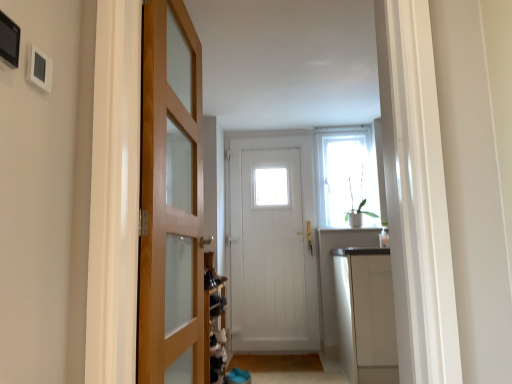
Locate an element on the screen. This screenshot has width=512, height=384. brown carpet at lower center, acting as the 2th path starting from the back is located at coordinates (288, 369).

Where is `brown wooden mat at lower center, positioned as the first path in back-to-front order`? brown wooden mat at lower center, positioned as the first path in back-to-front order is located at coordinates (276, 362).

What is the approximate height of wooden door at left, which appears as the first door when viewed from the left?

wooden door at left, which appears as the first door when viewed from the left, is 5.41 feet tall.

At what (x,y) coordinates should I click in order to perform the action: click on brown carpet at lower center, acting as the 2th path starting from the back. Please return your answer as a coordinate pair (x, y). Looking at the image, I should click on (288, 369).

Is wooden door at left, which appears as the first door when viewed from the left, looking in the opposite direction of white wooden door at center, arranged as the 2th door when viewed from the front?

No, wooden door at left, which appears as the first door when viewed from the left, is not facing away from white wooden door at center, arranged as the 2th door when viewed from the front.

From a real-world perspective, is wooden door at left, which appears as the first door when viewed from the left, below white wooden door at center, which appears as the first door when viewed from the back?

No.

At what (x,y) coordinates should I click in order to perform the action: click on door located below the wooden door at left, the 2th door when ordered from right to left (from the image's perspective). Please return your answer as a coordinate pair (x, y). The height and width of the screenshot is (384, 512). Looking at the image, I should click on (273, 246).

Is wooden door at left, the first door when ordered from front to back, directly adjacent to white wooden door at center, the second door from the left?

No, wooden door at left, the first door when ordered from front to back, is not beside white wooden door at center, the second door from the left.

Looking at this image, does green matte plant at upper right turn towards brown carpet at lower center, which is the 1th path from front to back?

No, green matte plant at upper right is not aimed at brown carpet at lower center, which is the 1th path from front to back.

Does green matte plant at upper right appear on the right side of brown carpet at lower center, which is the 1th path from front to back?

Yes.

Who is bigger, green matte plant at upper right or brown carpet at lower center, which is the 1th path from front to back?

green matte plant at upper right is bigger.

Looking at this image, what's the angular difference between green matte plant at upper right and brown carpet at lower center, which is the 1th path from front to back,'s facing directions?

The angle between the facing direction of green matte plant at upper right and the facing direction of brown carpet at lower center, which is the 1th path from front to back, is 1.01 degrees.

Does white glossy cabinet at right have a greater width compared to brown carpet at lower center, acting as the 2th path starting from the back?

In fact, white glossy cabinet at right might be narrower than brown carpet at lower center, acting as the 2th path starting from the back.

Could you tell me if white glossy cabinet at right is turned towards brown carpet at lower center, acting as the 2th path starting from the back?

No.

From the image's perspective, would you say white glossy cabinet at right is shown under brown carpet at lower center, acting as the 2th path starting from the back?

No, from the image's perspective, white glossy cabinet at right is not below brown carpet at lower center, acting as the 2th path starting from the back.

From a real-world perspective, is white glossy cabinet at right beneath brown carpet at lower center, acting as the 2th path starting from the back?

No, from a real-world perspective, white glossy cabinet at right is not beneath brown carpet at lower center, acting as the 2th path starting from the back.

Considering the relative positions of white glossy cabinet at right and green matte plant at upper right in the image provided, is white glossy cabinet at right behind green matte plant at upper right?

No, white glossy cabinet at right is in front of green matte plant at upper right.

Based on the photo, is green matte plant at upper right a part of white glossy cabinet at right?

No, green matte plant at upper right is not surrounded by white glossy cabinet at right.

Considering the sizes of objects white glossy cabinet at right and green matte plant at upper right in the image provided, who is smaller, white glossy cabinet at right or green matte plant at upper right?

Smaller between the two is green matte plant at upper right.

Looking at their sizes, would you say white glossy cabinet at right is wider or thinner than green matte plant at upper right?

white glossy cabinet at right is wider than green matte plant at upper right.

Which is farther, (361, 177) or (166, 288)?

Positioned behind is point (361, 177).

From a real-world perspective, who is located higher, green matte plant at upper right or wooden door at left, the first door when ordered from front to back?

From a 3D spatial view, green matte plant at upper right is above.

From the picture: Is green matte plant at upper right bigger or smaller than wooden door at left, which appears as the first door when viewed from the left?

Clearly, green matte plant at upper right is smaller in size than wooden door at left, which appears as the first door when viewed from the left.

From the image's perspective, is brown carpet at lower center, acting as the 2th path starting from the back, over white glossy cabinet at right?

No.

Can you tell me how much brown carpet at lower center, acting as the 2th path starting from the back, and white glossy cabinet at right differ in facing direction?

There is a 0.136-degree angle between the facing directions of brown carpet at lower center, acting as the 2th path starting from the back, and white glossy cabinet at right.

Is brown carpet at lower center, which is the 1th path from front to back, situated inside white glossy cabinet at right or outside?

The correct answer is: outside.

Is brown carpet at lower center, which is the 1th path from front to back, far from clear glass window at upper center?

Yes.

Is brown carpet at lower center, acting as the 2th path starting from the back, positioned with its back to clear glass window at upper center?

brown carpet at lower center, acting as the 2th path starting from the back, is not turned away from clear glass window at upper center.

From a real-world perspective, is brown carpet at lower center, which is the 1th path from front to back, over clear glass window at upper center?

No.

Considering the points (259, 365) and (330, 224), which point is in front, point (259, 365) or point (330, 224)?

Positioned in front is point (259, 365).

Where is `door located underneath the wooden door at left, the second door when ordered from back to front (from a real-world perspective)`? door located underneath the wooden door at left, the second door when ordered from back to front (from a real-world perspective) is located at coordinates (273, 246).

Find the location of a particular element. The height and width of the screenshot is (384, 512). plant lying on the right of brown carpet at lower center, acting as the 2th path starting from the back is located at coordinates (357, 211).

From the image, which object appears to be farther from white wooden door at center, the second door from the left, green matte plant at upper right or clear glass window at upper center?

Among the two, green matte plant at upper right is located further to white wooden door at center, the second door from the left.

Based on their spatial positions, is brown wooden mat at lower center, the 2th path viewed from the front, or white wooden door at center, which appears as the first door when viewed from the back, closer to white glossy cabinet at right?

brown wooden mat at lower center, the 2th path viewed from the front.

When comparing their distances from white glossy cabinet at right, does clear glass window at upper center or wooden door at left, the first door when ordered from front to back, seem further?

wooden door at left, the first door when ordered from front to back, is further to white glossy cabinet at right.

Looking at the image, which one is located further to white wooden door at center, the second door from the left, brown wooden mat at lower center, positioned as the first path in back-to-front order, or clear glass window at upper center?

Based on the image, brown wooden mat at lower center, positioned as the first path in back-to-front order, appears to be further to white wooden door at center, the second door from the left.

From the image, which object appears to be nearer to brown wooden mat at lower center, the 2th path viewed from the front, green matte plant at upper right or white glossy cabinet at right?

white glossy cabinet at right lies closer to brown wooden mat at lower center, the 2th path viewed from the front, than the other object.

Looking at the image, which one is located further to wooden door at left, the 2th door when ordered from right to left, white glossy cabinet at right or brown carpet at lower center, which is the 1th path from front to back?

brown carpet at lower center, which is the 1th path from front to back, lies further to wooden door at left, the 2th door when ordered from right to left, than the other object.

Considering their positions, is green matte plant at upper right positioned further to white wooden door at center, marked as the 1th door in a right-to-left arrangement, than wooden door at left, the first door when ordered from front to back?

The object further to white wooden door at center, marked as the 1th door in a right-to-left arrangement, is wooden door at left, the first door when ordered from front to back.

Based on their spatial positions, is brown wooden mat at lower center, the 2th path viewed from the front, or brown carpet at lower center, which is the 1th path from front to back, closer to green matte plant at upper right?

brown wooden mat at lower center, the 2th path viewed from the front, is positioned closer to the anchor green matte plant at upper right.

Where is `door between green matte plant at upper right and brown carpet at lower center, acting as the 2th path starting from the back, in the up-down direction`? door between green matte plant at upper right and brown carpet at lower center, acting as the 2th path starting from the back, in the up-down direction is located at coordinates (273, 246).

Where is `cabinetry that lies between clear glass window at upper center and brown carpet at lower center, acting as the 2th path starting from the back, from top to bottom`? This screenshot has width=512, height=384. cabinetry that lies between clear glass window at upper center and brown carpet at lower center, acting as the 2th path starting from the back, from top to bottom is located at coordinates (365, 314).

I want to click on door between green matte plant at upper right and brown wooden mat at lower center, positioned as the first path in back-to-front order, in the vertical direction, so [x=273, y=246].

The width and height of the screenshot is (512, 384). Find the location of `plant that lies between clear glass window at upper center and brown carpet at lower center, acting as the 2th path starting from the back, from top to bottom`. plant that lies between clear glass window at upper center and brown carpet at lower center, acting as the 2th path starting from the back, from top to bottom is located at coordinates (357, 211).